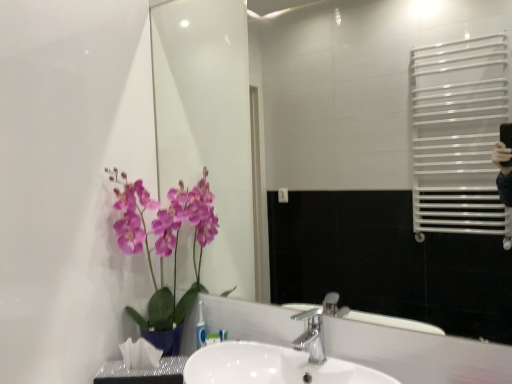
Question: From a real-world perspective, does purple silk orchid at left stand above transparent glass mirror at upper center?

Choices:
 (A) yes
 (B) no

Answer: (B)

Question: Can you confirm if purple silk orchid at left is taller than transparent glass mirror at upper center?

Choices:
 (A) no
 (B) yes

Answer: (A)

Question: Is transparent glass mirror at upper center a part of purple silk orchid at left?

Choices:
 (A) yes
 (B) no

Answer: (B)

Question: From the image's perspective, is purple silk orchid at left over transparent glass mirror at upper center?

Choices:
 (A) no
 (B) yes

Answer: (A)

Question: Does purple silk orchid at left turn towards transparent glass mirror at upper center?

Choices:
 (A) no
 (B) yes

Answer: (A)

Question: Can you confirm if purple silk orchid at left is shorter than transparent glass mirror at upper center?

Choices:
 (A) yes
 (B) no

Answer: (A)

Question: Considering the relative sizes of silver metallic faucet at center and transparent glass mirror at upper center in the image provided, is silver metallic faucet at center bigger than transparent glass mirror at upper center?

Choices:
 (A) yes
 (B) no

Answer: (B)

Question: Is silver metallic faucet at center completely or partially outside of transparent glass mirror at upper center?

Choices:
 (A) yes
 (B) no

Answer: (A)

Question: Could you tell me if silver metallic faucet at center is turned towards transparent glass mirror at upper center?

Choices:
 (A) yes
 (B) no

Answer: (B)

Question: Does silver metallic faucet at center appear on the right side of transparent glass mirror at upper center?

Choices:
 (A) no
 (B) yes

Answer: (B)

Question: From the image's perspective, would you say silver metallic faucet at center is positioned over transparent glass mirror at upper center?

Choices:
 (A) no
 (B) yes

Answer: (A)

Question: Does silver metallic faucet at center have a greater height compared to transparent glass mirror at upper center?

Choices:
 (A) no
 (B) yes

Answer: (A)

Question: From a real-world perspective, is purple silk orchid at left beneath white glossy sink at center?

Choices:
 (A) no
 (B) yes

Answer: (A)